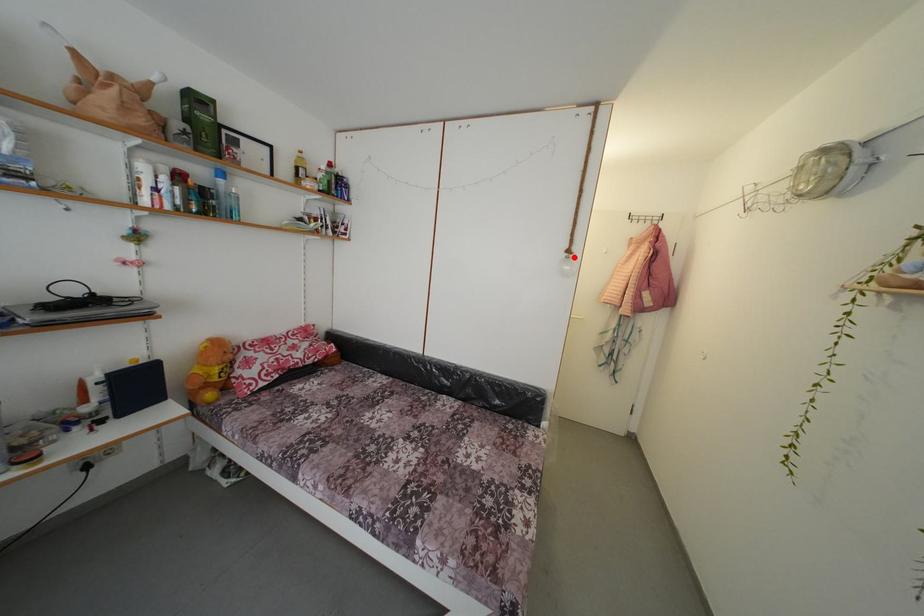
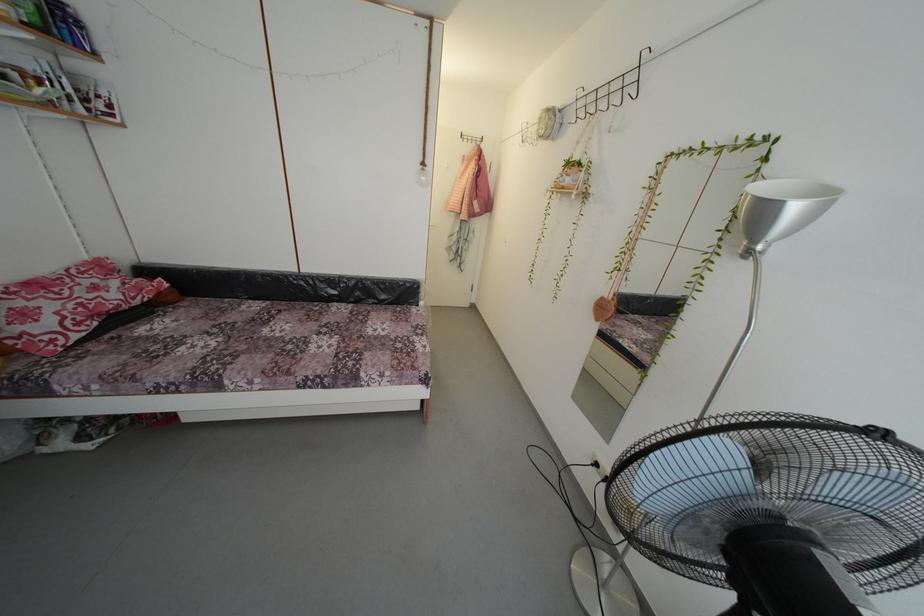
The point at the highlighted location is marked in the first image. Where is the corresponding point in the second image?

(429, 169)